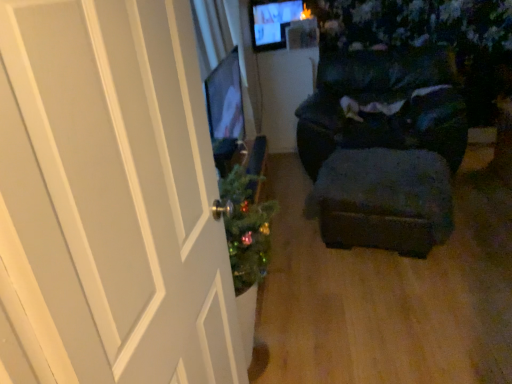
This screenshot has width=512, height=384. What are the coordinates of `vacant space in front of velvet dark blue stool at center` in the screenshot? It's located at (409, 298).